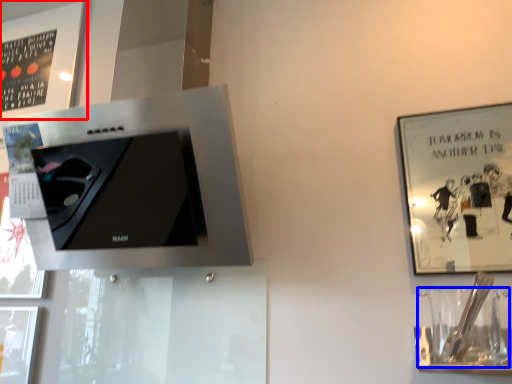
Question: Among these objects, which one is nearest to the camera, picture frame (highlighted by a red box) or wine glass (highlighted by a blue box)?

Choices:
 (A) picture frame
 (B) wine glass

Answer: (B)